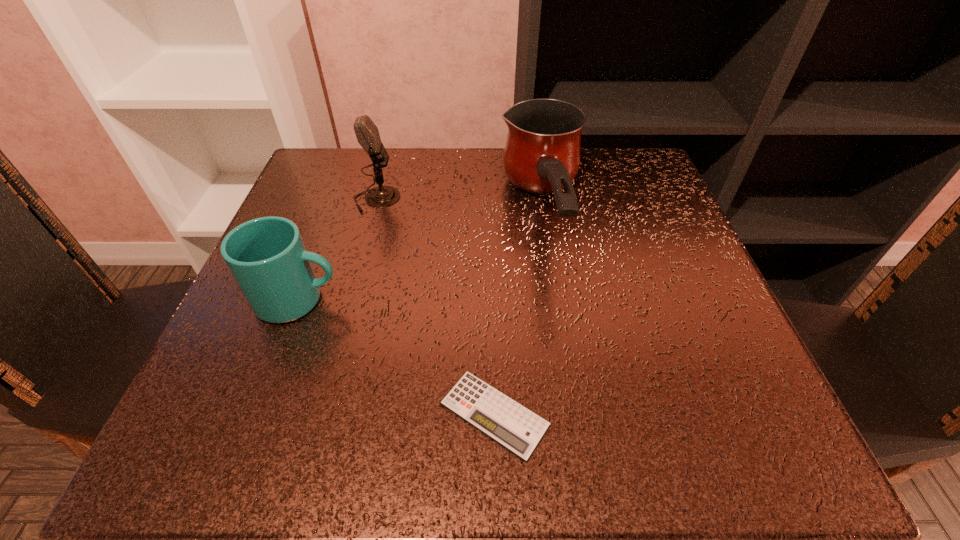
In the image, there is a desktop. What are the coordinates of `free space at the far right corner` in the screenshot? It's located at 590,178.

In order to click on empty space between the shortest object and the cup in this screenshot , I will do `click(396, 357)`.

Identify the location of unoccupied position between the microphone and the cup. (338, 249).

You are a GUI agent. You are given a task and a screenshot of the screen. Output one action in this format:
    pyautogui.click(x=<x>, y=<y>)
    Task: Click on the empty space that is in between the third tallest object and the nearest object
    This screenshot has height=540, width=960.
    Given the screenshot: What is the action you would take?
    (396, 357)

Locate an element on the screen. vacant space that's between the saucepan and the cup is located at coordinates (420, 257).

At what (x,y) coordinates should I click in order to perform the action: click on free space that is in between the microphone and the saucepan. Please return your answer as a coordinate pair (x, y). Looking at the image, I should click on (460, 206).

Where is `empty location between the saucepan and the second shortest object`? empty location between the saucepan and the second shortest object is located at coordinates (420, 257).

The image size is (960, 540). I want to click on empty space that is in between the cup and the calculator, so click(396, 357).

You are a GUI agent. You are given a task and a screenshot of the screen. Output one action in this format:
    pyautogui.click(x=<x>, y=<y>)
    Task: Click on the free space between the cup and the microphone
    This screenshot has height=540, width=960.
    Given the screenshot: What is the action you would take?
    pyautogui.click(x=338, y=249)

What are the coordinates of `free space between the microphone and the third tallest object` in the screenshot? It's located at (338, 249).